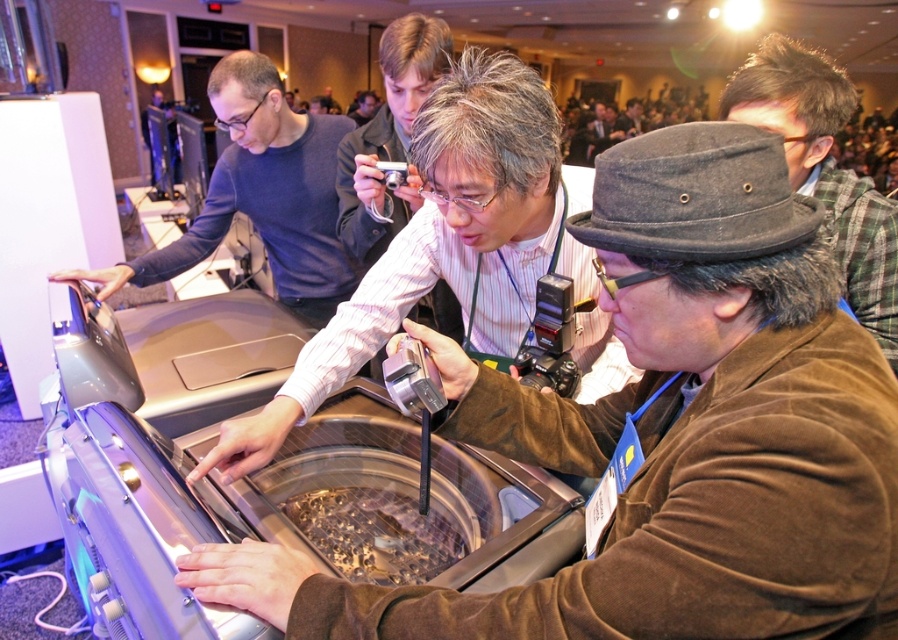
Question: Is matte black shirt at left above shiny metallic food at center?

Choices:
 (A) yes
 (B) no

Answer: (A)

Question: Is matte black shirt at left to the left of shiny metallic food at center from the viewer's perspective?

Choices:
 (A) no
 (B) yes

Answer: (B)

Question: Which point is farther to the camera?

Choices:
 (A) (602, 358)
 (B) (797, 147)
 (C) (306, 520)

Answer: (B)

Question: Which point is closer to the camera?

Choices:
 (A) matte black shirt at left
 (B) matte black shirt at center

Answer: (B)

Question: Does matte black shirt at center have a lesser width compared to matte black shirt at left?

Choices:
 (A) yes
 (B) no

Answer: (B)

Question: Which object appears closest to the camera in this image?

Choices:
 (A) dark gray fur hat at upper right
 (B) matte black shirt at center
 (C) matte black shirt at left

Answer: (A)